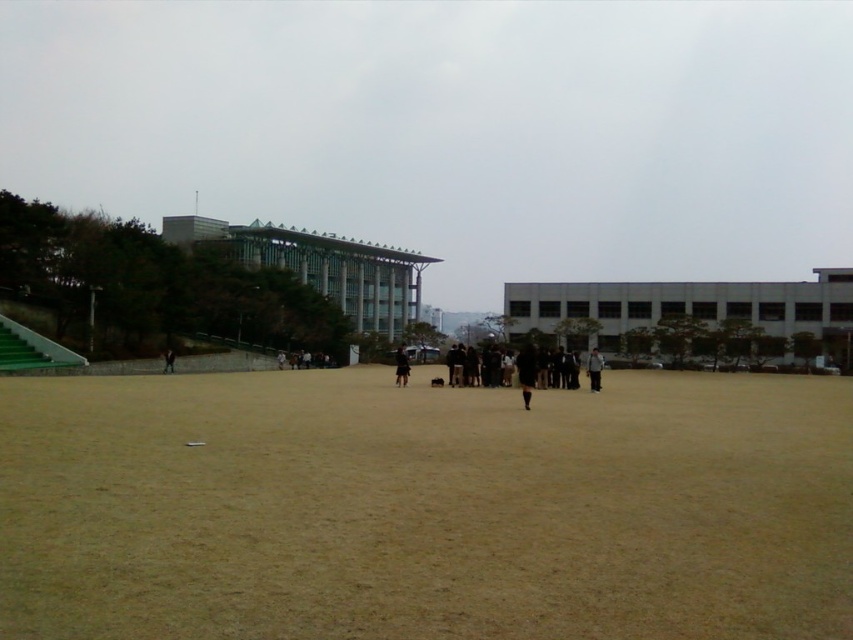
Question: Does dark brown leather jacket at center have a smaller size compared to black fabric person at center?

Choices:
 (A) no
 (B) yes

Answer: (B)

Question: Which object is farther from the camera taking this photo?

Choices:
 (A) black matte jacket at center
 (B) brown sandy dirt field at center

Answer: (A)

Question: Which point appears farthest from the camera in this image?

Choices:
 (A) (523, 356)
 (B) (408, 374)
 (C) (163, 353)

Answer: (C)

Question: Which of the following is the farthest from the observer?

Choices:
 (A) matte black person at center
 (B) dark brown leather jacket at center

Answer: (A)

Question: Does brown sandy dirt field at center lie in front of matte black person at center?

Choices:
 (A) no
 (B) yes

Answer: (B)

Question: Does dark brown leather jacket at center have a greater width compared to matte black person at center?

Choices:
 (A) no
 (B) yes

Answer: (B)